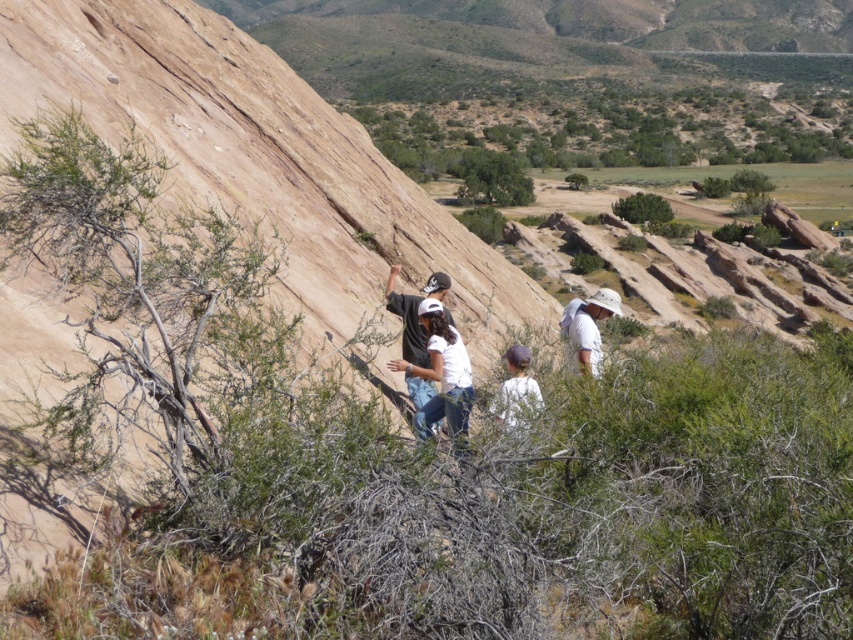
You are a hiker trying to identify clothing items in the scene. There is a white matte shirt at center and a white fabric at center. Which one is positioned lower in the image?

The white matte shirt at center is below white fabric at center, so the white matte shirt at center is positioned lower.

You are a photographer trying to capture the group hiking on the rock formation. You want to ensure both the white matte shirt at center and the white fabric hat at center are visible in the photo. Which object should you focus on to ensure it doesn not get lost in the background?

The white matte shirt at center is smaller than the white fabric hat at center, so you should focus on the white fabric hat at center to ensure it doesn not get lost in the background.

You are a photographer trying to capture a clear photo of the white matte shirt at center and the white fabric hat at center. Since both are white, you need to adjust your camera settings to differentiate them. According to the scene description, which object is narrower in width?

The white matte shirt at center is thinner than the white fabric hat at center, so the white matte shirt at center is narrower in width.